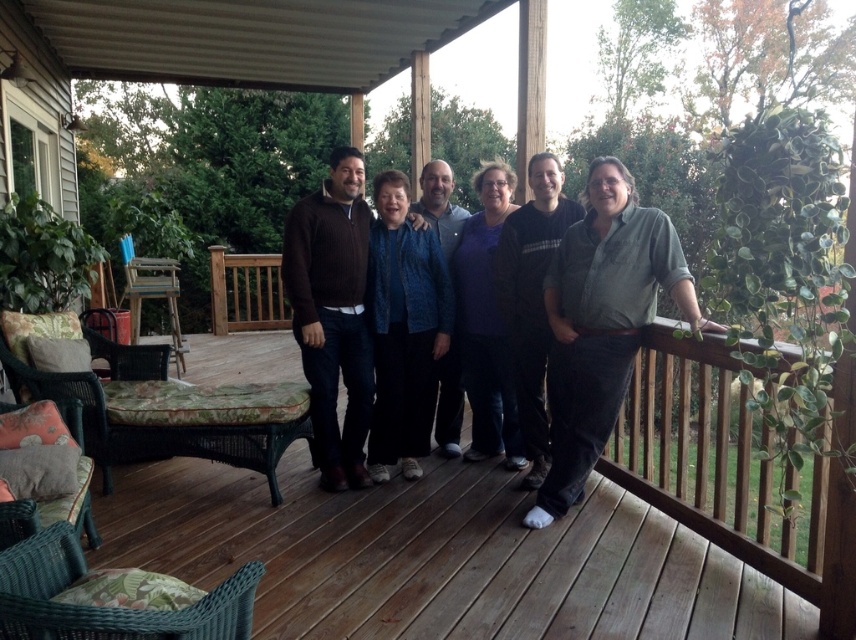
You are a photographer trying to adjust the composition of the group photo. You want to ensure that the green cotton shirt at right and the brown sweater at center are both visible in the frame. Given their heights, which one might you need to ask to stand slightly taller to balance the composition?

The green cotton shirt at right is not as tall as the brown sweater at center, so you should ask the person wearing the green cotton shirt at right to stand slightly taller to balance the composition.

You are standing at the center of the porch and want to hand a gift to the person wearing the green cotton shirt at right. Which direction should you move to reach them?

The green cotton shirt at right is located at point 0.506 on the x axis and 0.706 on the y axis, so you should move to the right and forward to reach them.

You are a photographer trying to adjust the lighting for a group photo. You notice the green cotton shirt at right and the brown sweater at center. Which one is closer to the camera?

The green cotton shirt at right is closer to the camera because it is in front of the brown sweater at center.